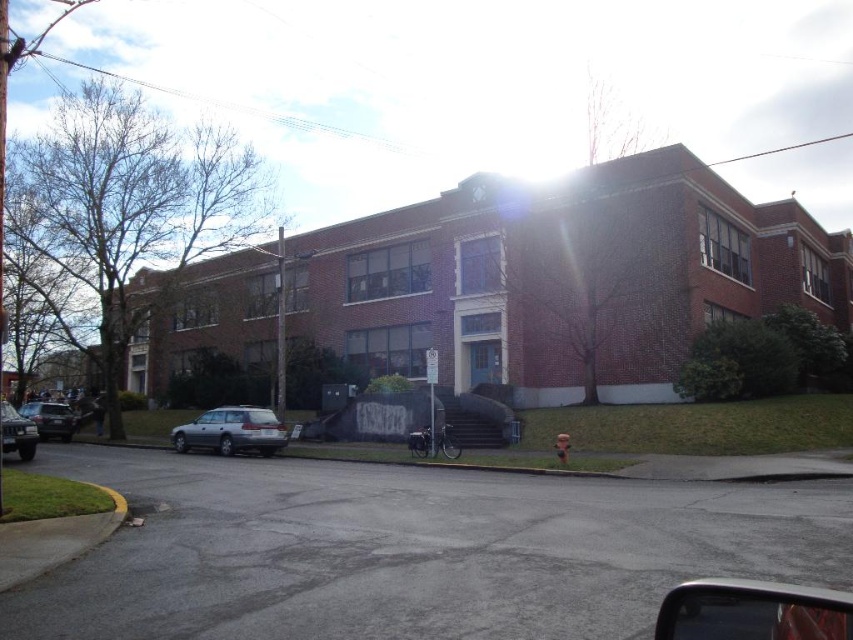
You are a delivery driver who needs to park your vehicle in the parking lot behind the building. You see a shiny silver sedan at left and a metallic silver sedan at lower left. Which vehicle should you avoid parking next to if you want to leave first?

You should avoid parking next to the shiny silver sedan at left because it is bigger than the metallic silver sedan at lower left, so it might require more space to maneuver out.

You are a delivery driver who needs to park your vehicle in the parking lot behind the building. You see the satin silver station wagon at lower left and the shiny silver sedan at left. Which vehicle has a narrower body to fit into a tight parking spot?

The satin silver station wagon at lower left is thinner than the shiny silver sedan at left, so it has a narrower body and would fit better into a tight parking spot.

You are a driver who needs to park your car in front of the building. You see a shiny silver sedan at left and a metallic silver sedan at lower left. Which one is closer to the central entrance of the building?

The metallic silver sedan at lower left is closer to the central entrance because it is positioned lower, which typically means it is nearer to the base of the building where the entrance is located.